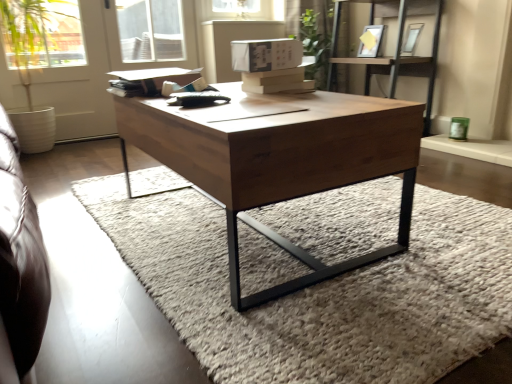
Locate an element on the screen. The image size is (512, 384). unoccupied region to the right of wooden coffee table at center is located at coordinates (411, 221).